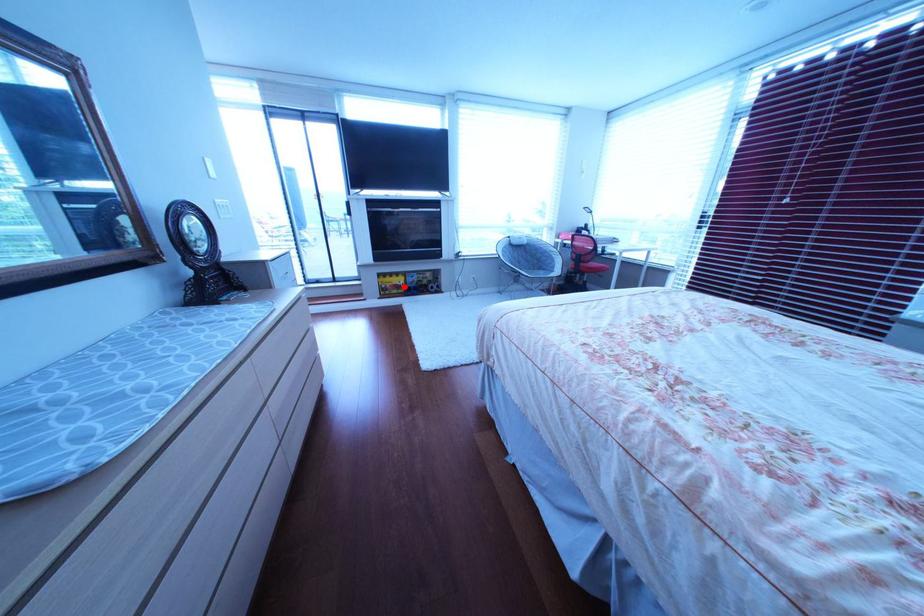
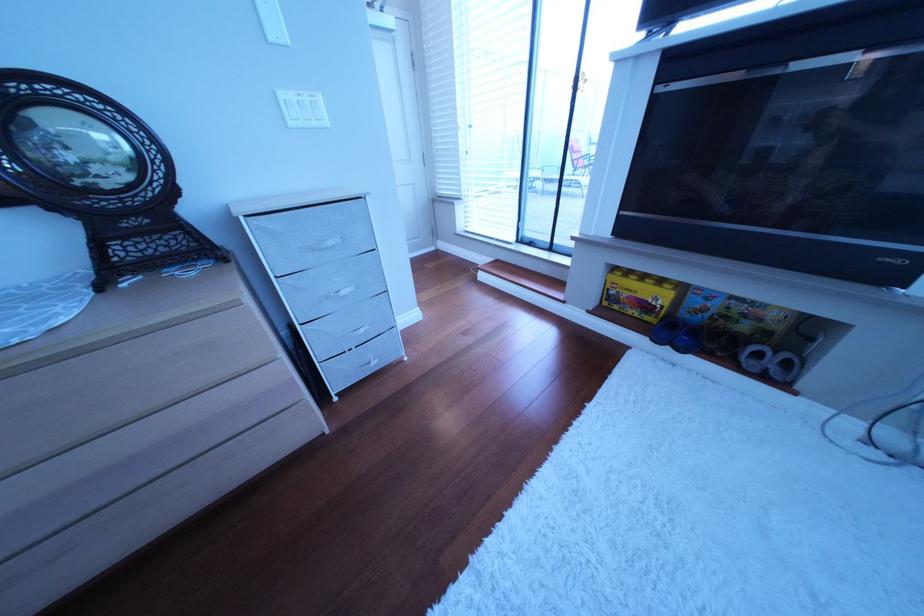
Question: A red point is marked in image1. In image2, is the corresponding 3D point closer to the camera or farther? Reply with the corresponding letter.

Choices:
 (A) The corresponding 3D point is closer.
 (B) The corresponding 3D point is farther.

Answer: (B)